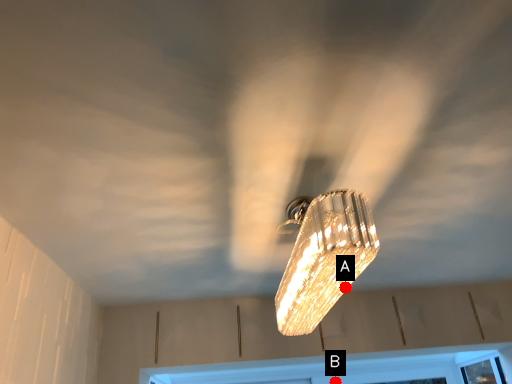
Question: Two points are circled on the image, labeled by A and B beside each circle. Which point appears closest to the camera in this image?

Choices:
 (A) A is closer
 (B) B is closer

Answer: (A)